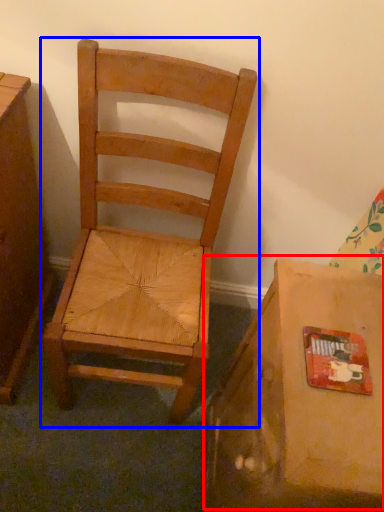
Question: Which of the following is the farthest to the observer, cardboard box (highlighted by a red box) or chair (highlighted by a blue box)?

Choices:
 (A) cardboard box
 (B) chair

Answer: (B)